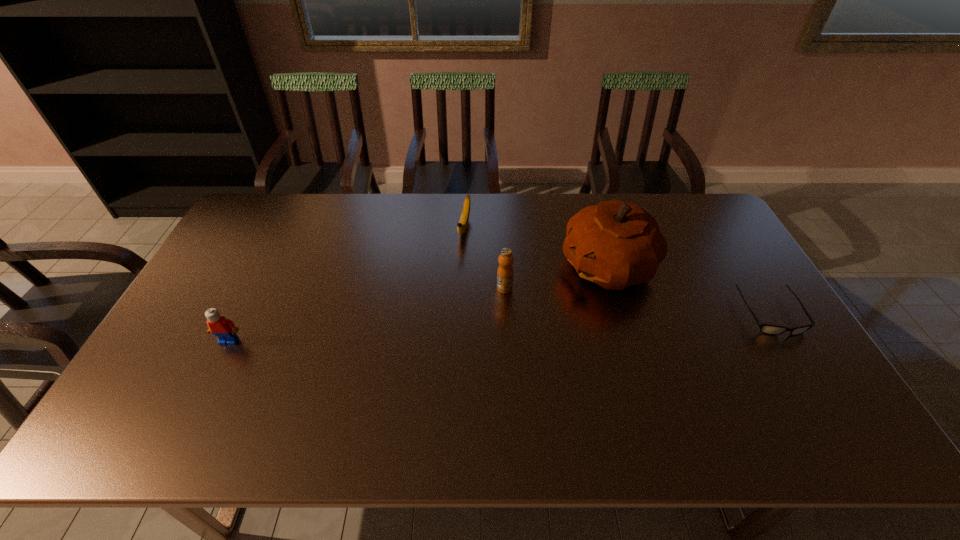
The height and width of the screenshot is (540, 960). I want to click on the third tallest object, so click(x=224, y=329).

Where is `the leftmost object`? the leftmost object is located at coordinates (224, 329).

Identify the location of the rightmost object. The height and width of the screenshot is (540, 960). (768, 329).

Where is `the shortest object`? The width and height of the screenshot is (960, 540). the shortest object is located at coordinates (768, 329).

Where is `the second object from left to right`? the second object from left to right is located at coordinates (463, 223).

Locate an element on the screen. The image size is (960, 540). the fourth tallest object is located at coordinates (463, 223).

This screenshot has width=960, height=540. Identify the location of the fourth object from left to right. (615, 244).

Find the location of a particular element. This screenshot has height=540, width=960. pumpkin is located at coordinates (615, 244).

Identify the location of the third object from left to right. The image size is (960, 540). (505, 272).

The height and width of the screenshot is (540, 960). What are the coordinates of `the second tallest object` in the screenshot? It's located at (505, 272).